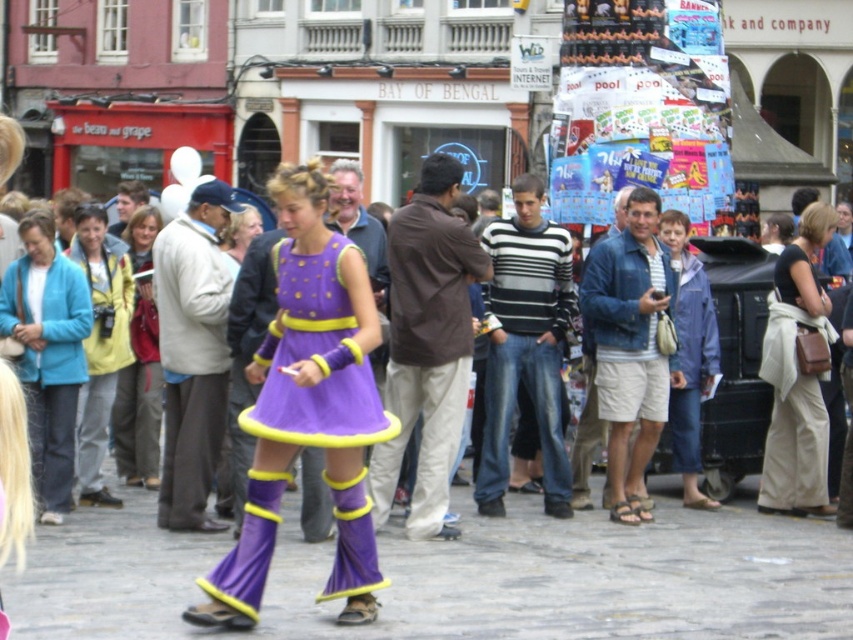
You are standing at the point with coordinates point (x=119, y=209) and want to walk towards the point with coordinates point (x=202, y=448). Which direction should you move?

You should move forward because point (x=202, y=448) is in front of point (x=119, y=209).

You are a photographer trying to capture a candid shot of the light beige sweater at center and the light brown leather jacket at center in the crowd. Which one is blocking the view of the other?

The light beige sweater at center is in front of the light brown leather jacket at center, so it is blocking the view of the jacket.